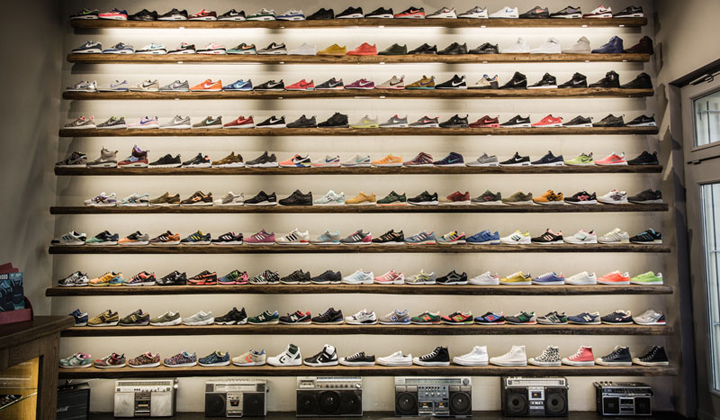
You are a GUI agent. You are given a task and a screenshot of the screen. Output one action in this format:
    pyautogui.click(x=<x>, y=<y>)
    Task: Click on the boomboxes
    Image resolution: width=720 pixels, height=420 pixels.
    Given the screenshot: What is the action you would take?
    pyautogui.click(x=72, y=404), pyautogui.click(x=140, y=407), pyautogui.click(x=220, y=403), pyautogui.click(x=330, y=404), pyautogui.click(x=440, y=402), pyautogui.click(x=541, y=401), pyautogui.click(x=634, y=404)